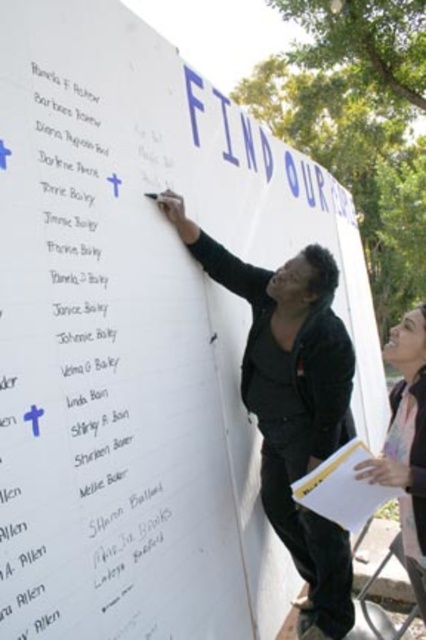
Question: Does matte black jacket at center appear on the left side of light brown hair at upper right?

Choices:
 (A) no
 (B) yes

Answer: (B)

Question: From the image, what is the correct spatial relationship of matte black jacket at center in relation to light brown hair at upper right?

Choices:
 (A) left
 (B) right

Answer: (A)

Question: Does matte black jacket at center appear on the right side of light brown hair at upper right?

Choices:
 (A) yes
 (B) no

Answer: (B)

Question: Which point is farther to the camera?

Choices:
 (A) (316, 248)
 (B) (402, 547)

Answer: (A)

Question: Which of the following is the closest to the observer?

Choices:
 (A) light brown hair at upper right
 (B) matte black jacket at center

Answer: (B)